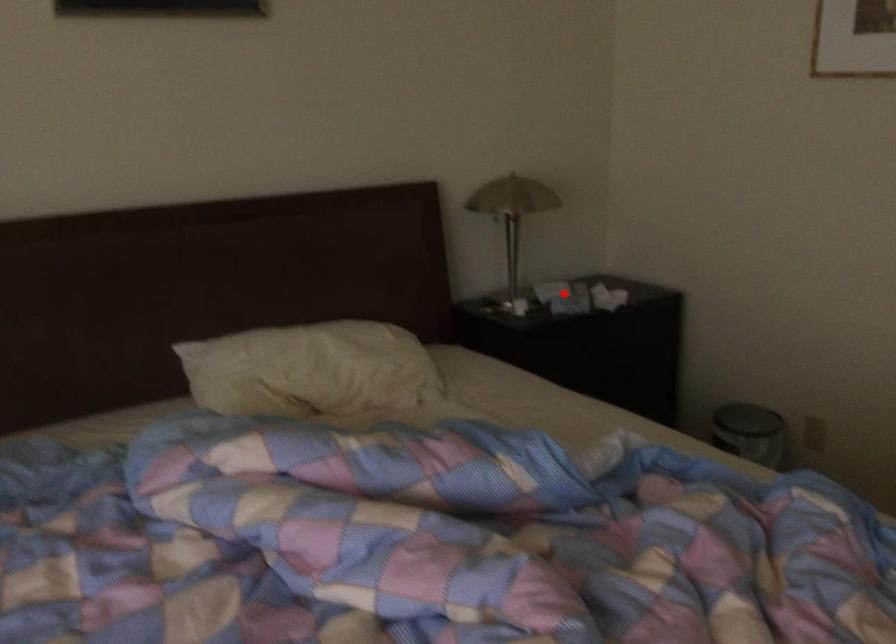
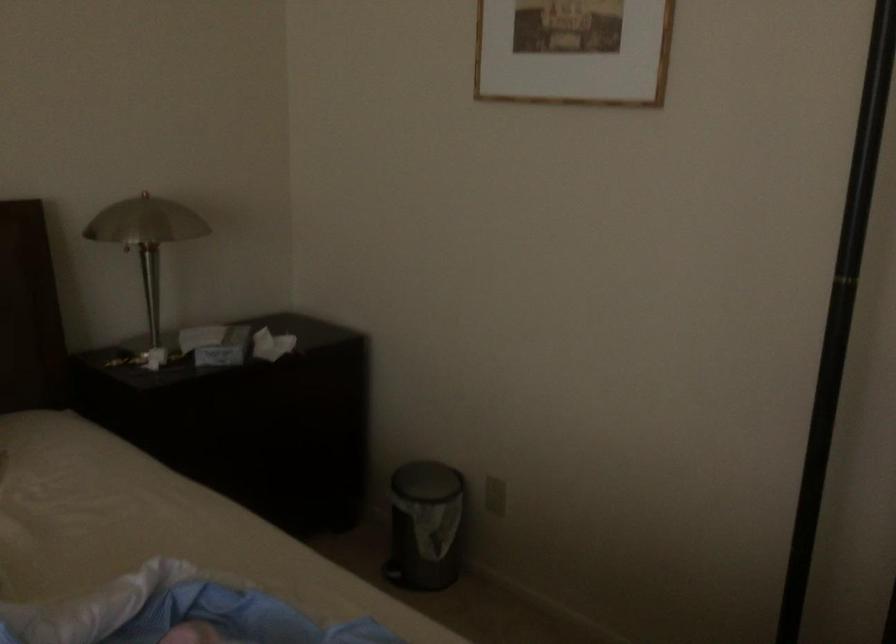
Question: I am providing you with two images of the same scene from different viewpoints. In image1, a red point is highlighted. Considering the same 3D point in image2, which of the following is correct?

Choices:
 (A) It is closer
 (B) It is farther

Answer: (A)